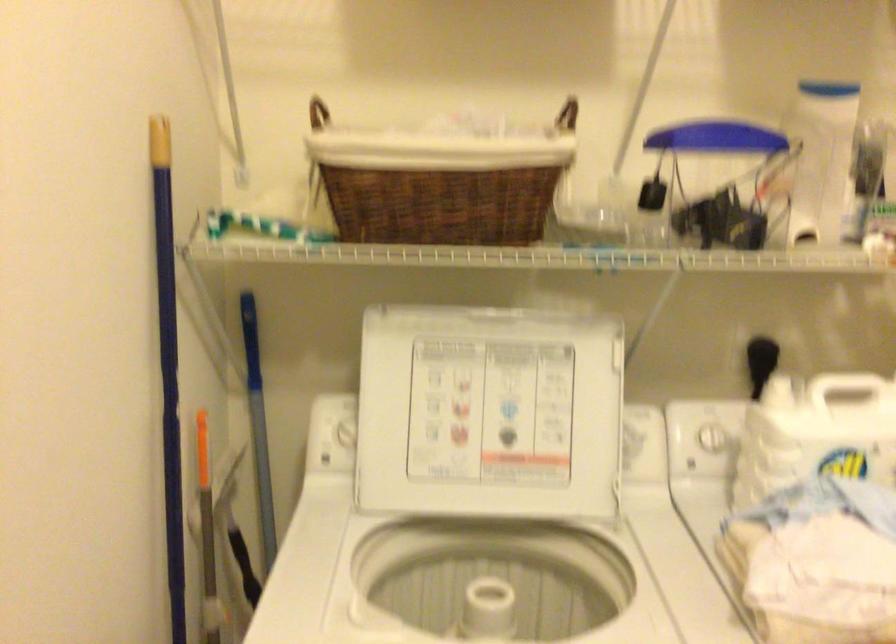
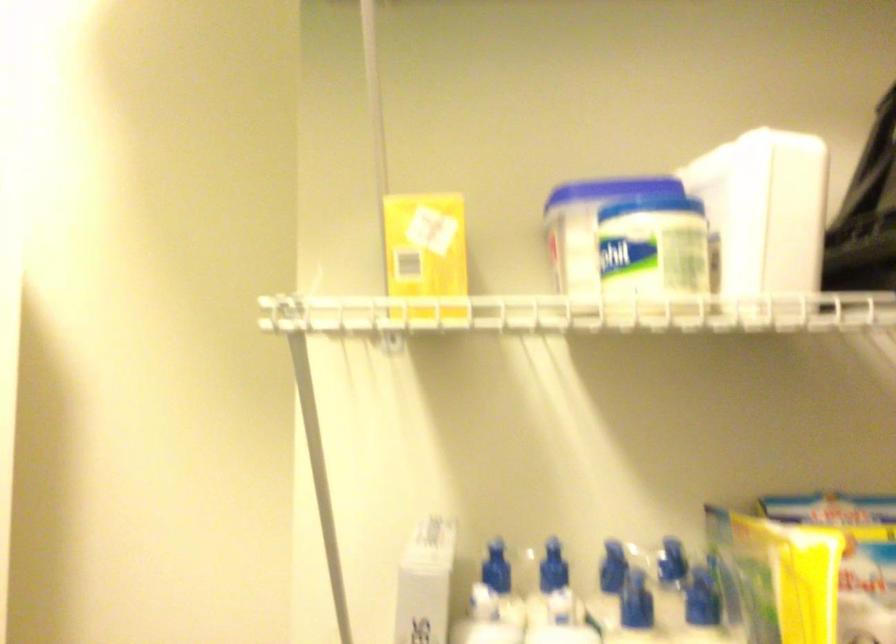
Question: The camera is either moving clockwise (left) or counter-clockwise (right) around the object. The first image is from the beginning of the video and the second image is from the end. Is the camera moving left or right when shooting the video?

Choices:
 (A) Left
 (B) Right

Answer: (A)